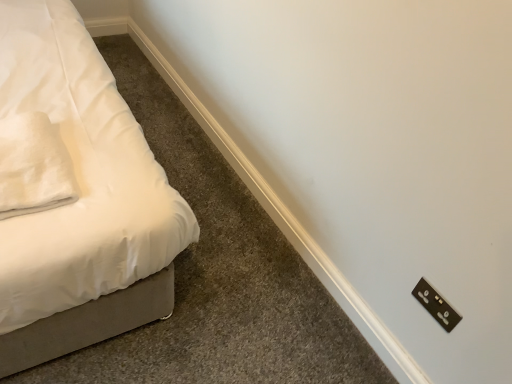
Question: From the image's perspective, is white soft fabric pillow at left located above or below black plastic light switch at lower right?

Choices:
 (A) below
 (B) above

Answer: (B)

Question: Relative to black plastic light switch at lower right, is white soft fabric pillow at left in front or behind?

Choices:
 (A) behind
 (B) front

Answer: (B)

Question: Considering the positions of point (52, 193) and point (426, 284), is point (52, 193) closer or farther from the camera than point (426, 284)?

Choices:
 (A) closer
 (B) farther

Answer: (A)

Question: Relative to white soft fabric pillow at left, is black plastic light switch at lower right in front or behind?

Choices:
 (A) behind
 (B) front

Answer: (A)

Question: Which is correct: black plastic light switch at lower right is inside white soft fabric pillow at left, or outside of it?

Choices:
 (A) inside
 (B) outside

Answer: (B)

Question: From their relative heights in the image, would you say black plastic light switch at lower right is taller or shorter than white soft fabric pillow at left?

Choices:
 (A) short
 (B) tall

Answer: (B)

Question: From the image's perspective, is black plastic light switch at lower right located above or below white soft fabric pillow at left?

Choices:
 (A) above
 (B) below

Answer: (B)